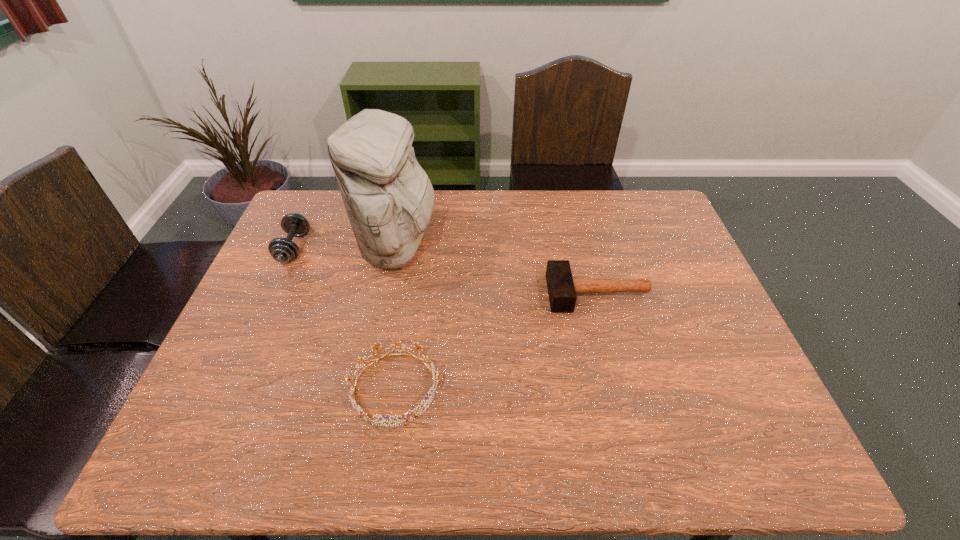
This screenshot has height=540, width=960. What are the coordinates of `the tallest object` in the screenshot? It's located at (388, 197).

The width and height of the screenshot is (960, 540). I want to click on the second tallest object, so click(283, 250).

Find the location of a particular element. This screenshot has width=960, height=540. dumbbell is located at coordinates (283, 250).

At what (x,y) coordinates should I click in order to perform the action: click on tiara. Please return your answer as a coordinate pair (x, y). Looking at the image, I should click on (362, 414).

Locate an element on the screen. The width and height of the screenshot is (960, 540). the rightmost object is located at coordinates (562, 287).

Identify the location of free space located 0.090m on the front-facing side of the tallest object. The height and width of the screenshot is (540, 960). (466, 247).

Where is `free space located on the right of the third shortest object`? free space located on the right of the third shortest object is located at coordinates (428, 248).

You are a GUI agent. You are given a task and a screenshot of the screen. Output one action in this format:
    pyautogui.click(x=<x>, y=<y>)
    Task: Click on the vacant space located on the front-facing side of the nearest object
    
    Given the screenshot: What is the action you would take?
    pyautogui.click(x=545, y=388)

Image resolution: width=960 pixels, height=540 pixels. I want to click on vacant area situated on the hammer head face of the mallet, so click(531, 293).

What are the coordinates of `free space located 0.200m on the hammer head face of the mallet` in the screenshot? It's located at (478, 293).